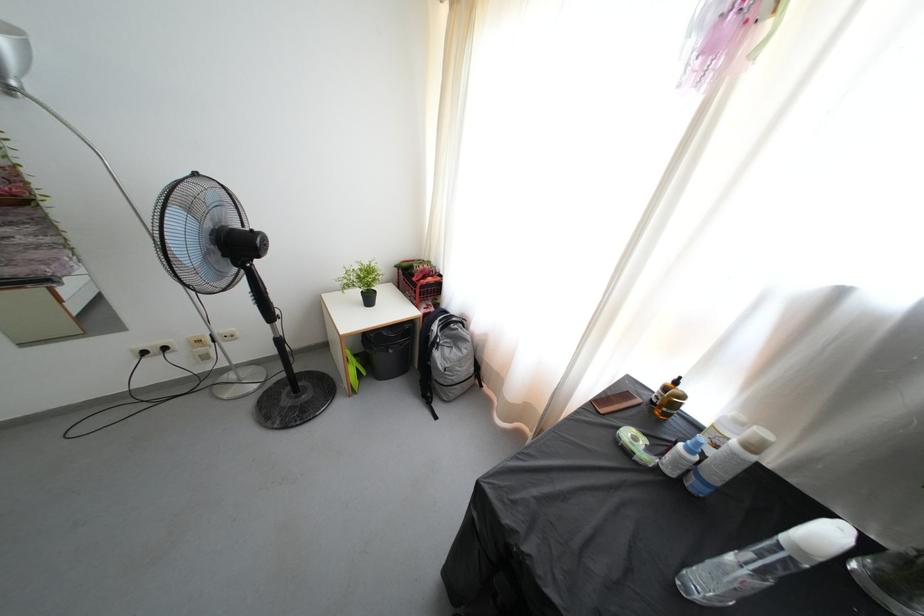
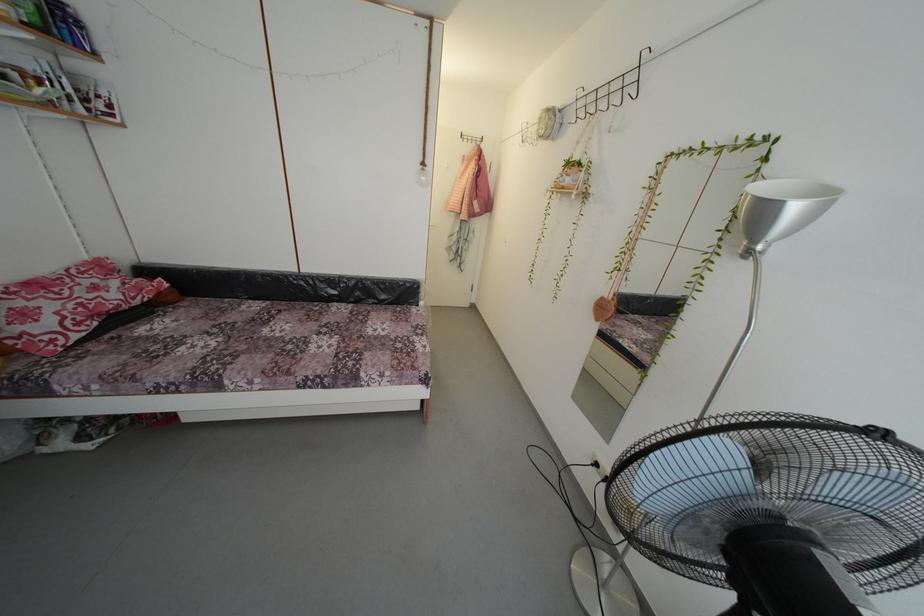
Locate, in the second image, the point that corresponds to (150,359) in the first image.

(602, 469)